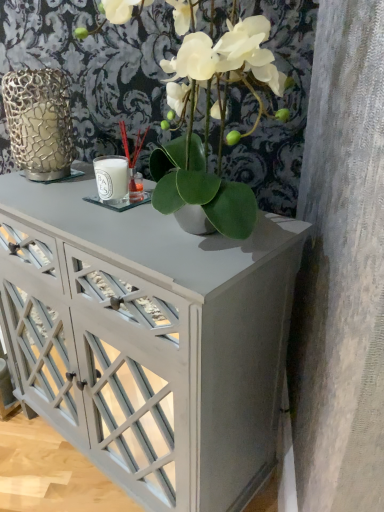
Find the location of `free point in front of gold textured vase at left`. free point in front of gold textured vase at left is located at coordinates (41, 197).